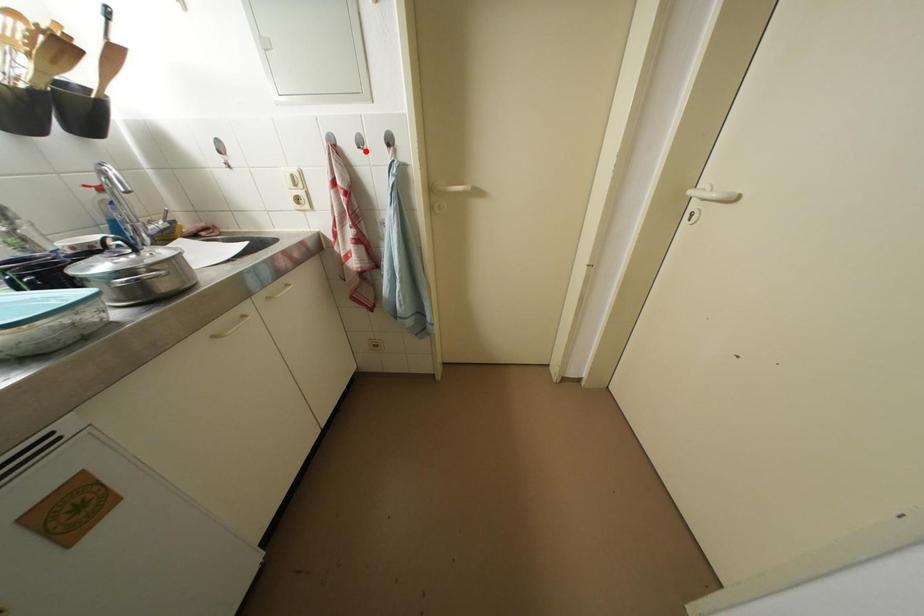
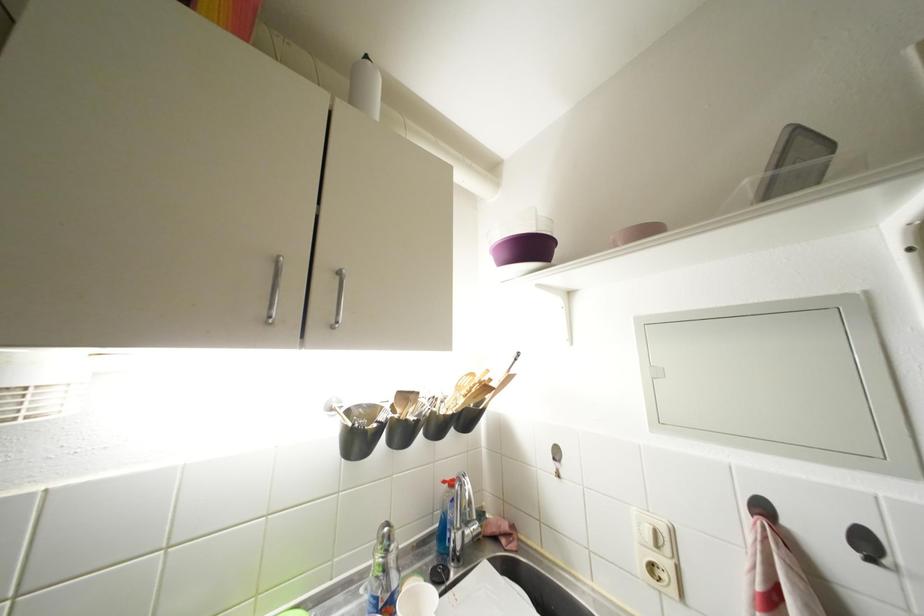
Locate, in the second image, the point that corresponds to the highlighted location in the first image.

(877, 565)